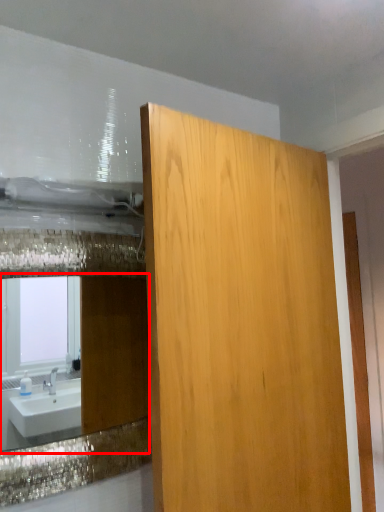
Question: In this image, where is mirror (annotated by the red box) located relative to bathroom cabinet?

Choices:
 (A) right
 (B) left

Answer: (B)